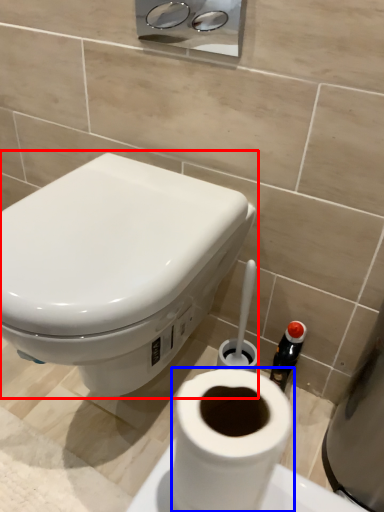
Question: Which object appears farthest to the camera in this image, toilet (highlighted by a red box) or toilet paper (highlighted by a blue box)?

Choices:
 (A) toilet
 (B) toilet paper

Answer: (A)